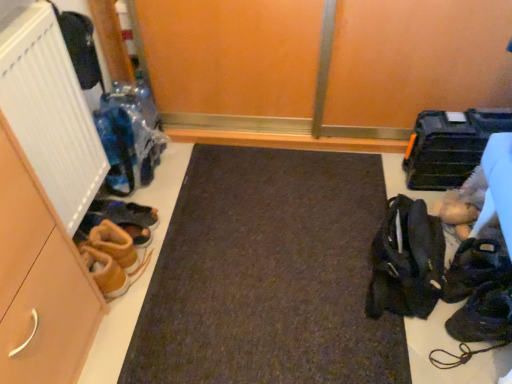
Question: Is black fabric bag at right at the left side of white ribbed radiator at left?

Choices:
 (A) no
 (B) yes

Answer: (A)

Question: Is black fabric bag at right turned away from white ribbed radiator at left?

Choices:
 (A) no
 (B) yes

Answer: (A)

Question: From the image's perspective, is black fabric bag at right on white ribbed radiator at left?

Choices:
 (A) yes
 (B) no

Answer: (B)

Question: Is black fabric bag at right shorter than white ribbed radiator at left?

Choices:
 (A) no
 (B) yes

Answer: (B)

Question: Can you confirm if black fabric bag at right is thinner than white ribbed radiator at left?

Choices:
 (A) no
 (B) yes

Answer: (A)

Question: From the image's perspective, is dark brown leather shoes at lower right, which appears as the 3th footwear when viewed from the left, positioned above or below brown suede shoes at lower left, which appears as the first footwear when viewed from the left?

Choices:
 (A) below
 (B) above

Answer: (A)

Question: In the image, is dark brown leather shoes at lower right, which appears as the 3th footwear when viewed from the left, on the left side or the right side of brown suede shoes at lower left, which appears as the first footwear when viewed from the left?

Choices:
 (A) right
 (B) left

Answer: (A)

Question: Is dark brown leather shoes at lower right, which appears as the 3th footwear when viewed from the left, taller or shorter than brown suede shoes at lower left, which appears as the first footwear when viewed from the left?

Choices:
 (A) tall
 (B) short

Answer: (A)

Question: From a real-world perspective, is dark brown leather shoes at lower right, which appears as the 3th footwear when viewed from the left, positioned above or below brown suede shoes at lower left, which appears as the first footwear when viewed from the left?

Choices:
 (A) below
 (B) above

Answer: (B)

Question: In terms of height, does brown suede shoes at left, the third footwear viewed from the right, look taller or shorter compared to matte brown cabinet at left?

Choices:
 (A) short
 (B) tall

Answer: (A)

Question: Is brown suede shoes at left, the third footwear viewed from the right, in front of or behind matte brown cabinet at left in the image?

Choices:
 (A) behind
 (B) front

Answer: (A)

Question: From a real-world perspective, is brown suede shoes at left, the third footwear viewed from the right, above or below matte brown cabinet at left?

Choices:
 (A) above
 (B) below

Answer: (B)

Question: Is point (105, 208) positioned closer to the camera than point (35, 337)?

Choices:
 (A) farther
 (B) closer

Answer: (A)

Question: Is black fabric bag at right wider or thinner than dark brown leather shoes at lower right, which appears as the 3th footwear when viewed from the left?

Choices:
 (A) wide
 (B) thin

Answer: (B)

Question: Looking at the image, does black fabric bag at right seem bigger or smaller compared to dark brown leather shoes at lower right, which is the second footwear from right to left?

Choices:
 (A) small
 (B) big

Answer: (B)